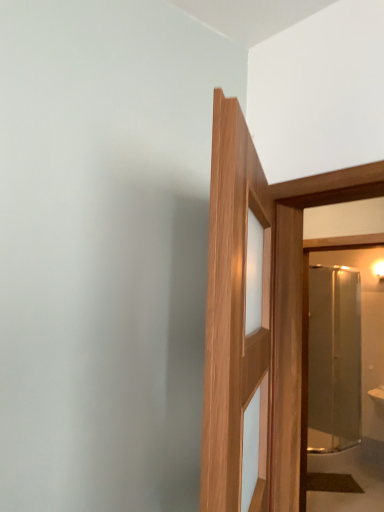
What is the approximate height of clear glass mirror at right?

clear glass mirror at right is 1.85 meters in height.

Measure the distance between point [304,394] and camera.

Point [304,394] and camera are 1.75 meters apart.

This screenshot has height=512, width=384. Describe the element at coordinates (308, 327) in the screenshot. I see `clear glass mirror at right` at that location.

At what (x,y) coordinates should I click in order to perform the action: click on clear glass mirror at right. Please return your answer as a coordinate pair (x, y). The image size is (384, 512). Looking at the image, I should click on (308, 327).

In order to face clear glass mirror at right, should I rotate leftwards or rightwards?

You should rotate right by 19.093 degrees.

Identify the location of clear glass mirror at right. The width and height of the screenshot is (384, 512). (308, 327).